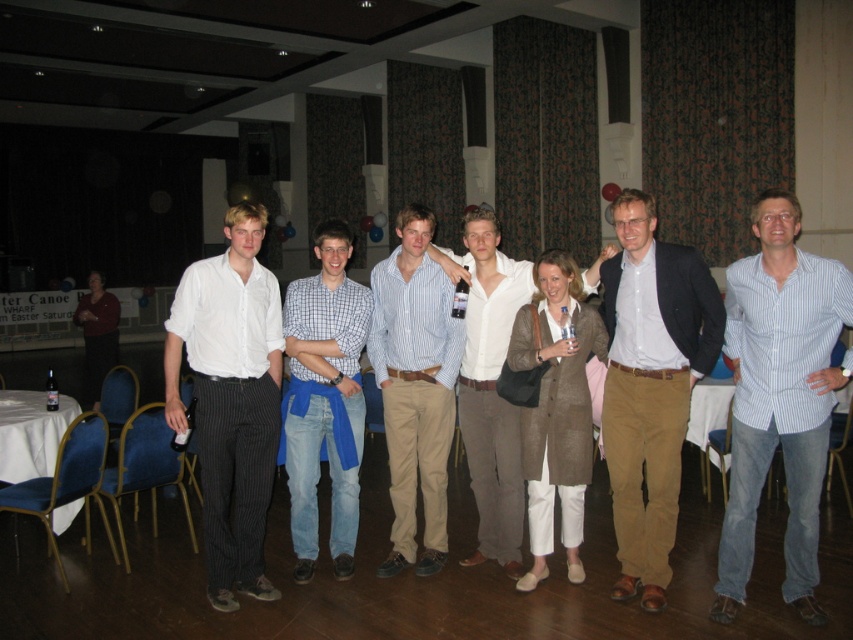
Can you confirm if white cotton shirt at center is smaller than striped cotton shirt at center?

No, white cotton shirt at center is not smaller than striped cotton shirt at center.

Where is `white cotton shirt at center`? Image resolution: width=853 pixels, height=640 pixels. white cotton shirt at center is located at coordinates [230, 397].

Does point (637, 312) come in front of point (273, 438)?

That is True.

Does point (625, 410) come behind point (212, 496)?

Yes, point (625, 410) is farther from viewer.

Who is more forward, (634, 577) or (248, 227)?

Point (248, 227) is more forward.

This screenshot has height=640, width=853. Identify the location of matte white shirt at center. (651, 385).

How distant is striped cotton shirt at center from blue denim jeans at center?

They are 11.17 inches apart.

Is striped cotton shirt at center to the left of blue denim jeans at center from the viewer's perspective?

No, striped cotton shirt at center is not to the left of blue denim jeans at center.

Does point (447, 428) come behind point (363, 337)?

Yes, point (447, 428) is farther from viewer.

You are a GUI agent. You are given a task and a screenshot of the screen. Output one action in this format:
    pyautogui.click(x=<x>, y=<y>)
    Task: Click on the striped cotton shirt at center
    
    Given the screenshot: What is the action you would take?
    pyautogui.click(x=415, y=387)